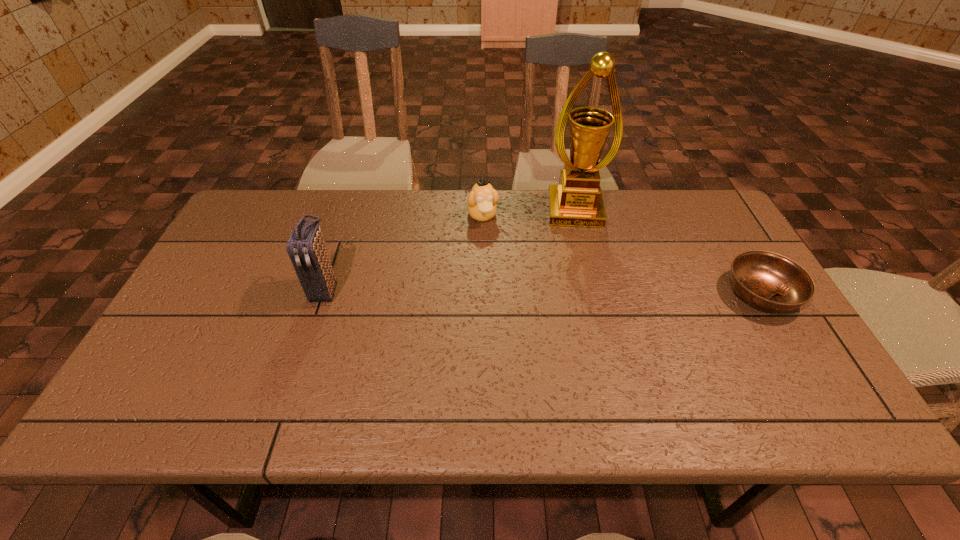
Find the location of a particular element. vacant space that is in between the tallest object and the third object from right to left is located at coordinates (529, 213).

Where is `free area in between the shortest object and the award`? free area in between the shortest object and the award is located at coordinates (668, 252).

At what (x,y) coordinates should I click in order to perform the action: click on unoccupied area between the third object from left to right and the second tallest object. Please return your answer as a coordinate pair (x, y). Image resolution: width=960 pixels, height=540 pixels. Looking at the image, I should click on (450, 250).

The image size is (960, 540). I want to click on free area in between the leftmost object and the shortest object, so click(543, 292).

Locate an element on the screen. Image resolution: width=960 pixels, height=540 pixels. free spot between the tallest object and the third shortest object is located at coordinates (450, 250).

Identify the location of unoccupied position between the third object from left to right and the second object from left to right. The image size is (960, 540). (529, 213).

Locate an element on the screen. This screenshot has height=540, width=960. empty space that is in between the third tallest object and the soup bowl is located at coordinates (622, 254).

Locate which object is the third closest to the award. Please provide its 2D coordinates. Your answer should be formatted as a tuple, i.e. [(x, y)], where the tuple contains the x and y coordinates of a point satisfying the conditions above.

[(306, 248)]

You are a GUI agent. You are given a task and a screenshot of the screen. Output one action in this format:
    pyautogui.click(x=<x>, y=<y>)
    Task: Click on the object identified as the third closest to the clutch bag
    The image size is (960, 540).
    Given the screenshot: What is the action you would take?
    pyautogui.click(x=768, y=281)

Identify the location of vacant point that satisfies the following two spatial constraints: 1. with the zip open on the clutch bag; 2. on the right side of the soup bowl. (324, 293).